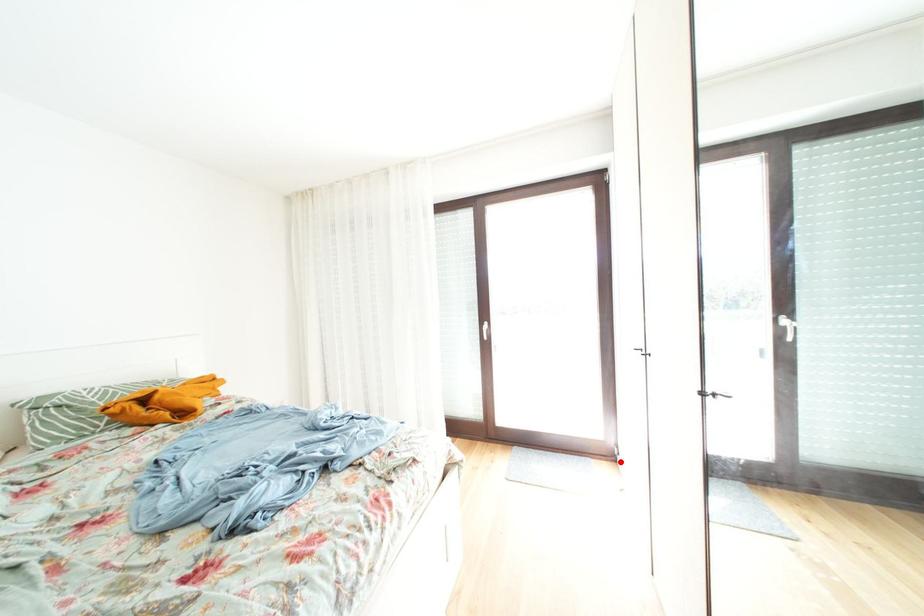
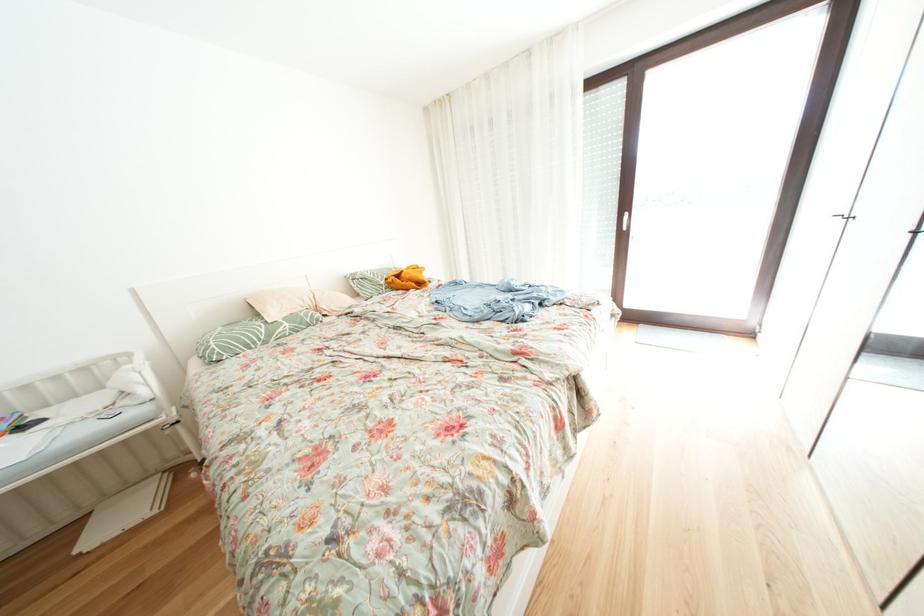
Where in the second image is the point corresponding to the highlighted location from the first image?

(759, 339)